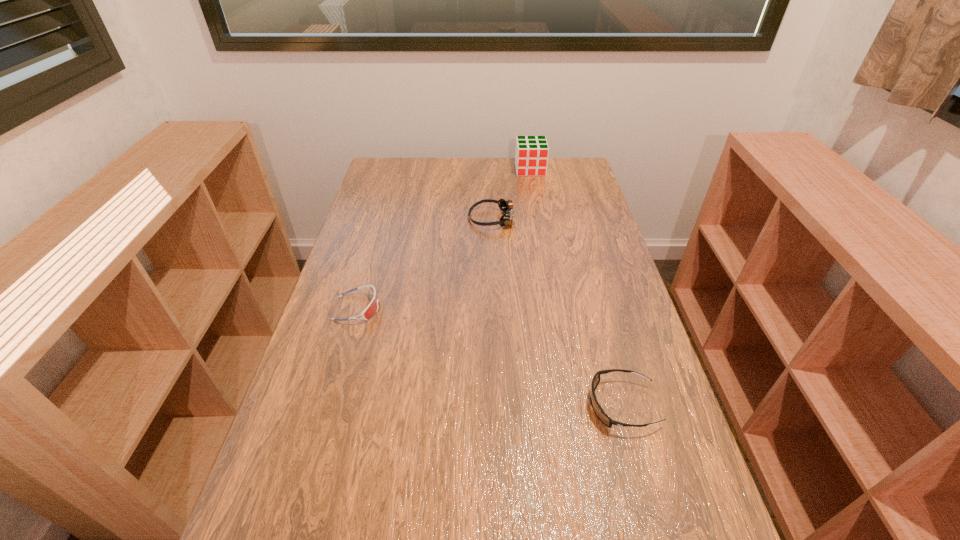
Locate an element on the screen. The image size is (960, 540). object present at the far right corner is located at coordinates (531, 155).

Where is `free space at the far edge of the desktop`? This screenshot has height=540, width=960. free space at the far edge of the desktop is located at coordinates 463,170.

In the image, there is a desktop. Where is `vacant space at the left edge`? This screenshot has width=960, height=540. vacant space at the left edge is located at coordinates (348, 269).

This screenshot has height=540, width=960. In the image, there is a desktop. In order to click on free region at the right edge in this screenshot , I will do `click(563, 231)`.

Image resolution: width=960 pixels, height=540 pixels. What are the coordinates of `free region at the far left corner of the desktop` in the screenshot? It's located at [379, 163].

The width and height of the screenshot is (960, 540). I want to click on free space between the tallest object and the second farthest object, so click(512, 194).

Identify the location of vacant region between the second nearest goggles and the rightmost goggles. This screenshot has height=540, width=960. (490, 357).

Locate an element on the screen. Image resolution: width=960 pixels, height=540 pixels. free space between the tallest object and the nearest goggles is located at coordinates (576, 287).

Where is `free point between the tallest object and the rightmost goggles`? free point between the tallest object and the rightmost goggles is located at coordinates (576, 287).

Locate an element on the screen. This screenshot has width=960, height=540. vacant space in between the farthest object and the leftmost goggles is located at coordinates (444, 239).